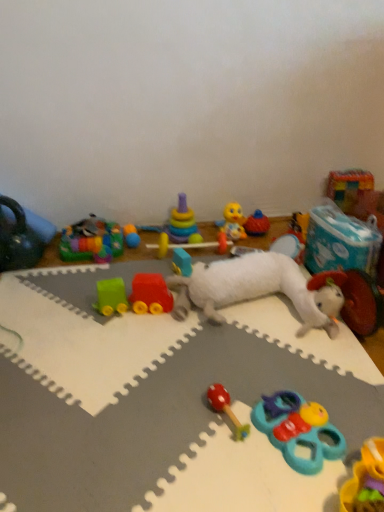
Identify the location of empty space that is in between blue rubber toy at lower right, arranged as the eleventh toy when viewed from the left, and white plush lamb at center, placed as the ninth toy when sorted from left to right. This screenshot has width=384, height=512. (277, 369).